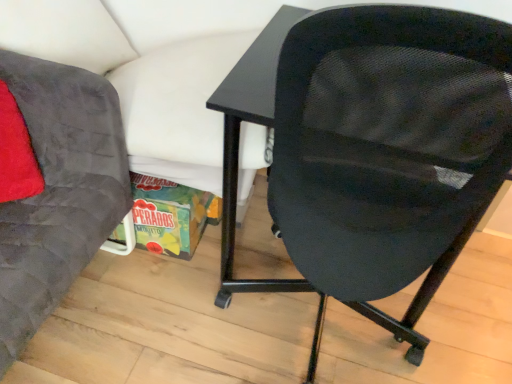
What do you see at coordinates (372, 147) in the screenshot? I see `black mesh chair at center, which is counted as the 2th chair, starting from the left` at bounding box center [372, 147].

You are a GUI agent. You are given a task and a screenshot of the screen. Output one action in this format:
    pyautogui.click(x=<x>, y=<y>)
    Task: Click on the black mesh chair at center, placed as the first chair when sorted from right to left
    The image size is (512, 384).
    Given the screenshot: What is the action you would take?
    pyautogui.click(x=372, y=147)

You are a GUI agent. You are given a task and a screenshot of the screen. Output one action in this format:
    pyautogui.click(x=<x>, y=<y>)
    Task: Click on the velvet gray chair at left, which is counted as the second chair, starting from the right
    Image resolution: width=512 pixels, height=384 pixels.
    Given the screenshot: What is the action you would take?
    pyautogui.click(x=55, y=188)

How much space does velvet gray chair at left, which is counted as the second chair, starting from the right, occupy vertically?

velvet gray chair at left, which is counted as the second chair, starting from the right, is 69.73 centimeters in height.

Describe the element at coordinates (55, 188) in the screenshot. This screenshot has width=512, height=384. I see `velvet gray chair at left, which is counted as the second chair, starting from the right` at that location.

What is the approximate width of velvet gray chair at left, which ranks as the first chair in left-to-right order?

velvet gray chair at left, which ranks as the first chair in left-to-right order, is 25.37 inches in width.

Find the location of a particular element. black mesh chair at center, placed as the first chair when sorted from right to left is located at coordinates (372, 147).

Based on the photo, between velvet gray chair at left, which ranks as the first chair in left-to-right order, and black mesh chair at center, which is counted as the 2th chair, starting from the left, which one appears on the left side from the viewer's perspective?

From the viewer's perspective, velvet gray chair at left, which ranks as the first chair in left-to-right order, appears more on the left side.

Is the position of velvet gray chair at left, which ranks as the first chair in left-to-right order, more distant than that of black mesh chair at center, which is counted as the 2th chair, starting from the left?

No, velvet gray chair at left, which ranks as the first chair in left-to-right order, is closer to the viewer.

Is point (97, 189) in front of point (359, 174)?

No, it is not.

From the image's perspective, is velvet gray chair at left, which ranks as the first chair in left-to-right order, located above or below black mesh chair at center, which is counted as the 2th chair, starting from the left?

velvet gray chair at left, which ranks as the first chair in left-to-right order, is below black mesh chair at center, which is counted as the 2th chair, starting from the left.

From a real-world perspective, is velvet gray chair at left, which ranks as the first chair in left-to-right order, positioned above or below black mesh chair at center, which is counted as the 2th chair, starting from the left?

velvet gray chair at left, which ranks as the first chair in left-to-right order, is situated lower than black mesh chair at center, which is counted as the 2th chair, starting from the left, in the real world.

Considering the sizes of objects velvet gray chair at left, which ranks as the first chair in left-to-right order, and black mesh chair at center, placed as the first chair when sorted from right to left, in the image provided, who is wider, velvet gray chair at left, which ranks as the first chair in left-to-right order, or black mesh chair at center, placed as the first chair when sorted from right to left,?

With larger width is black mesh chair at center, placed as the first chair when sorted from right to left.

Can you confirm if velvet gray chair at left, which ranks as the first chair in left-to-right order, is taller than black mesh chair at center, placed as the first chair when sorted from right to left?

No.

Looking at the image, does velvet gray chair at left, which is counted as the second chair, starting from the right, seem bigger or smaller compared to black mesh chair at center, which is counted as the 2th chair, starting from the left?

Considering their sizes, velvet gray chair at left, which is counted as the second chair, starting from the right, takes up less space than black mesh chair at center, which is counted as the 2th chair, starting from the left.

Could black mesh chair at center, which is counted as the 2th chair, starting from the left, be considered to be inside velvet gray chair at left, which ranks as the first chair in left-to-right order?

No, black mesh chair at center, which is counted as the 2th chair, starting from the left, is not a part of velvet gray chair at left, which ranks as the first chair in left-to-right order.

Is velvet gray chair at left, which ranks as the first chair in left-to-right order, far away from black mesh chair at center, which is counted as the 2th chair, starting from the left?

They are positioned close to each other.

Does velvet gray chair at left, which is counted as the second chair, starting from the right, turn towards black mesh chair at center, placed as the first chair when sorted from right to left?

No.

The image size is (512, 384). In order to click on chair located above the velvet gray chair at left, which is counted as the second chair, starting from the right (from a real-world perspective) in this screenshot , I will do `click(372, 147)`.

Is black mesh chair at center, which is counted as the 2th chair, starting from the left, at the right side of velvet gray chair at left, which ranks as the first chair in left-to-right order?

Indeed, black mesh chair at center, which is counted as the 2th chair, starting from the left, is positioned on the right side of velvet gray chair at left, which ranks as the first chair in left-to-right order.

Is black mesh chair at center, which is counted as the 2th chair, starting from the left, in front of or behind velvet gray chair at left, which is counted as the second chair, starting from the right, in the image?

Clearly, black mesh chair at center, which is counted as the 2th chair, starting from the left, is behind velvet gray chair at left, which is counted as the second chair, starting from the right.

Which is closer to the camera, (348, 156) or (109, 224)?

Point (348, 156) is positioned closer to the camera compared to point (109, 224).

From the image's perspective, is black mesh chair at center, placed as the first chair when sorted from right to left, positioned above or below velvet gray chair at left, which is counted as the second chair, starting from the right?

Clearly, from the image's perspective, black mesh chair at center, placed as the first chair when sorted from right to left, is above velvet gray chair at left, which is counted as the second chair, starting from the right.

From a real-world perspective, is black mesh chair at center, placed as the first chair when sorted from right to left, on top of velvet gray chair at left, which ranks as the first chair in left-to-right order?

Yes.

Which object is wider, black mesh chair at center, placed as the first chair when sorted from right to left, or velvet gray chair at left, which ranks as the first chair in left-to-right order?

black mesh chair at center, placed as the first chair when sorted from right to left, is wider.

Is black mesh chair at center, which is counted as the 2th chair, starting from the left, taller than velvet gray chair at left, which is counted as the second chair, starting from the right?

Correct, black mesh chair at center, which is counted as the 2th chair, starting from the left, is much taller as velvet gray chair at left, which is counted as the second chair, starting from the right.

Does black mesh chair at center, which is counted as the 2th chair, starting from the left, have a smaller size compared to velvet gray chair at left, which is counted as the second chair, starting from the right?

Incorrect, black mesh chair at center, which is counted as the 2th chair, starting from the left, is not smaller in size than velvet gray chair at left, which is counted as the second chair, starting from the right.

Could velvet gray chair at left, which ranks as the first chair in left-to-right order, be considered to be inside black mesh chair at center, placed as the first chair when sorted from right to left?

No.

Based on the photo, is black mesh chair at center, placed as the first chair when sorted from right to left, next to velvet gray chair at left, which is counted as the second chair, starting from the right?

They are not placed beside each other.

Is black mesh chair at center, placed as the first chair when sorted from right to left, turned away from velvet gray chair at left, which is counted as the second chair, starting from the right?

No.

How different are the orientations of black mesh chair at center, placed as the first chair when sorted from right to left, and velvet gray chair at left, which is counted as the second chair, starting from the right, in degrees?

They differ by 88.8 degrees in their facing directions.

Measure the distance from black mesh chair at center, placed as the first chair when sorted from right to left, to velvet gray chair at left, which ranks as the first chair in left-to-right order.

black mesh chair at center, placed as the first chair when sorted from right to left, is 57.79 centimeters away from velvet gray chair at left, which ranks as the first chair in left-to-right order.

Where is `chair on the right of velvet gray chair at left, which is counted as the second chair, starting from the right`? chair on the right of velvet gray chair at left, which is counted as the second chair, starting from the right is located at coordinates (372, 147).

The image size is (512, 384). What are the coordinates of `chair behind the velvet gray chair at left, which ranks as the first chair in left-to-right order` in the screenshot? It's located at (372, 147).

Locate an element on the screen. Image resolution: width=512 pixels, height=384 pixels. chair below the black mesh chair at center, which is counted as the 2th chair, starting from the left (from a real-world perspective) is located at coordinates (55, 188).